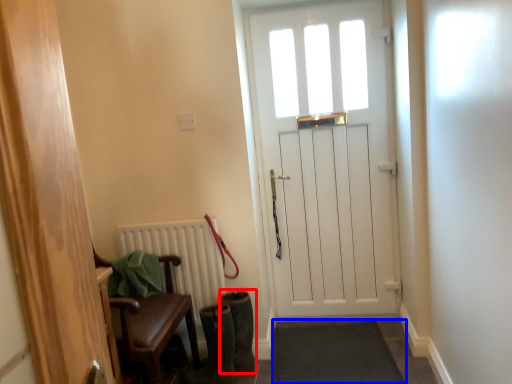
Question: Which object appears farthest to the camera in this image, boot (highlighted by a red box) or doormat (highlighted by a blue box)?

Choices:
 (A) boot
 (B) doormat

Answer: (A)